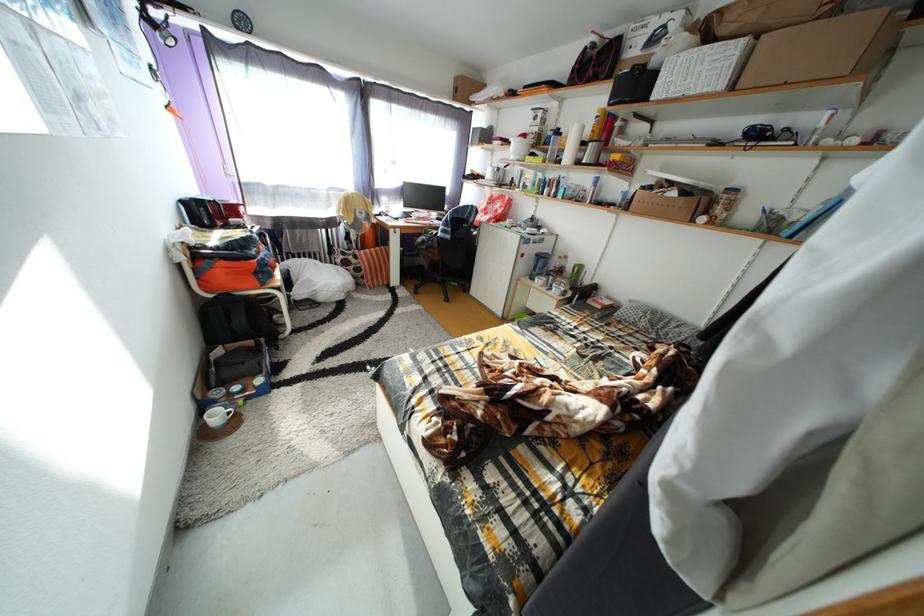
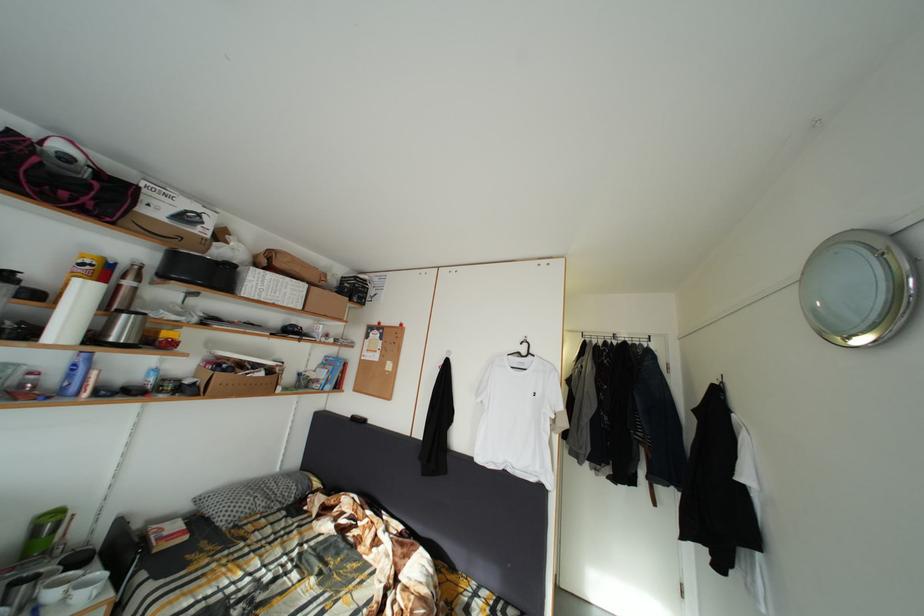
The point at [679,191] is marked in the first image. Where is the corresponding point in the second image?

(264, 373)